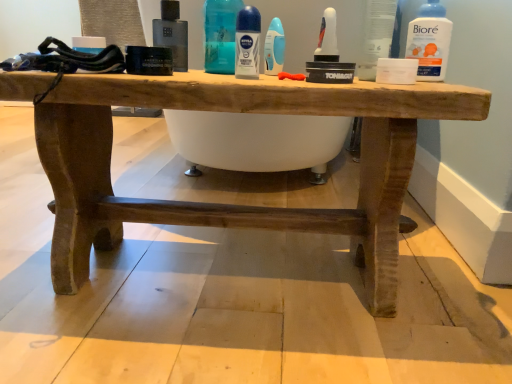
Identify the location of blue glossy deodorant stick at center, which is counted as the second mouthwash, starting from the right. This screenshot has width=512, height=384. (247, 43).

Where is `blue plastic deodorant at center, placed as the 2th cleaning product when sorted from right to left`? blue plastic deodorant at center, placed as the 2th cleaning product when sorted from right to left is located at coordinates (220, 35).

Where is `blue glossy deodorant stick at center, the 2th cleaning product viewed from the left`? The height and width of the screenshot is (384, 512). blue glossy deodorant stick at center, the 2th cleaning product viewed from the left is located at coordinates (274, 48).

Identify the location of white plastic bottle at upper right, which is the 1th mouthwash in right-to-left order. The image size is (512, 384). (429, 41).

The height and width of the screenshot is (384, 512). What do you see at coordinates (376, 36) in the screenshot? I see `transparent plastic container at upper right` at bounding box center [376, 36].

Locate an element on the screen. The image size is (512, 384). blue glossy deodorant stick at center, the second mouthwash when ordered from left to right is located at coordinates (247, 43).

Does point (268, 58) come behind point (245, 42)?

Yes, it is.

Where is `the 3rd mouthwash in front of the blue glossy deodorant stick at center, the 2th cleaning product viewed from the left, starting your count from the anchor`? This screenshot has width=512, height=384. the 3rd mouthwash in front of the blue glossy deodorant stick at center, the 2th cleaning product viewed from the left, starting your count from the anchor is located at coordinates (247, 43).

Consider the image. From a real-world perspective, is blue glossy deodorant stick at center, the 2th cleaning product viewed from the left, located higher than blue glossy deodorant stick at center, which is counted as the second mouthwash, starting from the right?

No, from a real-world perspective, blue glossy deodorant stick at center, the 2th cleaning product viewed from the left, is not above blue glossy deodorant stick at center, which is counted as the second mouthwash, starting from the right.

Which is more to the right, blue glossy deodorant stick at center, the 2th cleaning product viewed from the left, or blue glossy deodorant stick at center, the second mouthwash when ordered from left to right?

From the viewer's perspective, blue glossy deodorant stick at center, the 2th cleaning product viewed from the left, appears more on the right side.

In the scene shown: Is white plastic bottle at upper right, which is the 1th mouthwash in right-to-left order, positioned with its back to matte black bottle at center, placed as the 1th mouthwash when sorted from left to right?

No, matte black bottle at center, placed as the 1th mouthwash when sorted from left to right, is not at the back of white plastic bottle at upper right, which is the 1th mouthwash in right-to-left order.

Identify the location of mouthwash above the white plastic bottle at upper right, which is the 1th mouthwash in right-to-left order (from the image's perspective). (172, 34).

Would you say matte black bottle at center, the 3th mouthwash positioned from the right, is part of white plastic bottle at upper right, the third mouthwash when ordered from left to right,'s contents?

Definitely not — matte black bottle at center, the 3th mouthwash positioned from the right, is not inside white plastic bottle at upper right, the third mouthwash when ordered from left to right.

From a real-world perspective, is blue glossy deodorant stick at center, positioned as the first cleaning product in right-to-left order, beneath transparent plastic container at upper right?

Yes.

Considering the relative sizes of blue glossy deodorant stick at center, positioned as the first cleaning product in right-to-left order, and transparent plastic container at upper right in the image provided, is blue glossy deodorant stick at center, positioned as the first cleaning product in right-to-left order, shorter than transparent plastic container at upper right?

Yes.

Identify the location of the 2nd cleaning product behind when counting from the transparent plastic container at upper right. The image size is (512, 384). (274, 48).

Is blue glossy deodorant stick at center, positioned as the first cleaning product in right-to-left order, beside transparent plastic container at upper right?

blue glossy deodorant stick at center, positioned as the first cleaning product in right-to-left order, and transparent plastic container at upper right are not in contact.

Is point (321, 87) behind point (372, 17)?

No, it is in front of (372, 17).

Which of these two, rustic wood table at center or transparent plastic container at upper right, is bigger?

With larger size is rustic wood table at center.

From a real-world perspective, is rustic wood table at center on transparent plastic container at upper right?

No.

Does white plastic bottle at upper right, which is the 1th mouthwash in right-to-left order, touch rustic wood table at center?

No, white plastic bottle at upper right, which is the 1th mouthwash in right-to-left order, is not beside rustic wood table at center.

Is white plastic bottle at upper right, the third mouthwash when ordered from left to right, shorter than rustic wood table at center?

Yes.

From the image's perspective, is white plastic bottle at upper right, the third mouthwash when ordered from left to right, above or below rustic wood table at center?

white plastic bottle at upper right, the third mouthwash when ordered from left to right, is above rustic wood table at center.

From a real-world perspective, is white plastic bottle at upper right, which is the 1th mouthwash in right-to-left order, physically below rustic wood table at center?

No, from a real-world perspective, white plastic bottle at upper right, which is the 1th mouthwash in right-to-left order, is not under rustic wood table at center.

Is matte black bottle at center, placed as the 1th mouthwash when sorted from left to right, completely or partially outside of rustic wood table at center?

That's correct, matte black bottle at center, placed as the 1th mouthwash when sorted from left to right, is outside of rustic wood table at center.

Consider the image. Measure the distance from matte black bottle at center, placed as the 1th mouthwash when sorted from left to right, to rustic wood table at center.

matte black bottle at center, placed as the 1th mouthwash when sorted from left to right, is 29.18 centimeters from rustic wood table at center.

Consider the image. Is matte black bottle at center, placed as the 1th mouthwash when sorted from left to right, wider or thinner than rustic wood table at center?

In the image, matte black bottle at center, placed as the 1th mouthwash when sorted from left to right, appears to be more narrow than rustic wood table at center.

Is rustic wood table at center at the back of matte black bottle at center, placed as the 1th mouthwash when sorted from left to right?

That's not correct — matte black bottle at center, placed as the 1th mouthwash when sorted from left to right, is not looking away from rustic wood table at center.

Considering the relative positions of rustic wood table at center and blue plastic deodorant at center, placed as the 2th cleaning product when sorted from right to left, in the image provided, is rustic wood table at center in front of blue plastic deodorant at center, placed as the 2th cleaning product when sorted from right to left,?

That is True.

Can you confirm if rustic wood table at center is thinner than blue plastic deodorant at center, the 1th cleaning product positioned from the left?

In fact, rustic wood table at center might be wider than blue plastic deodorant at center, the 1th cleaning product positioned from the left.

Is rustic wood table at center touching blue plastic deodorant at center, the 1th cleaning product positioned from the left?

No, rustic wood table at center is not beside blue plastic deodorant at center, the 1th cleaning product positioned from the left.

From their relative heights in the image, would you say rustic wood table at center is taller or shorter than blue plastic deodorant at center, the 1th cleaning product positioned from the left?

→ Considering their sizes, rustic wood table at center has more height than blue plastic deodorant at center, the 1th cleaning product positioned from the left.

The image size is (512, 384). What are the coordinates of `cleaning product that is the 2nd one when counting backward from the blue glossy deodorant stick at center, the second mouthwash when ordered from left to right` in the screenshot? It's located at (274, 48).

What are the coordinates of `the 1st mouthwash positioned below the matte black bottle at center, the 3th mouthwash positioned from the right (from the image's perspective)` in the screenshot? It's located at (429, 41).

From the image, which object appears to be farther from matte black bottle at center, the 3th mouthwash positioned from the right, blue glossy deodorant stick at center, the second mouthwash when ordered from left to right, or white plastic bottle at upper right, which is the 1th mouthwash in right-to-left order?

white plastic bottle at upper right, which is the 1th mouthwash in right-to-left order, is positioned further to the anchor matte black bottle at center, the 3th mouthwash positioned from the right.

Estimate the real-world distances between objects in this image. Which object is closer to white plastic bottle at upper right, the third mouthwash when ordered from left to right, blue glossy deodorant stick at center, the 2th cleaning product viewed from the left, or blue plastic deodorant at center, the 1th cleaning product positioned from the left?

blue glossy deodorant stick at center, the 2th cleaning product viewed from the left, is closer to white plastic bottle at upper right, the third mouthwash when ordered from left to right.

Estimate the real-world distances between objects in this image. Which object is closer to blue glossy deodorant stick at center, which is counted as the second mouthwash, starting from the right, white plastic bottle at upper right, the third mouthwash when ordered from left to right, or blue plastic deodorant at center, the 1th cleaning product positioned from the left?

blue plastic deodorant at center, the 1th cleaning product positioned from the left, lies closer to blue glossy deodorant stick at center, which is counted as the second mouthwash, starting from the right, than the other object.

Estimate the real-world distances between objects in this image. Which object is closer to transparent plastic container at upper right, blue glossy deodorant stick at center, the second mouthwash when ordered from left to right, or rustic wood table at center?

Among the two, blue glossy deodorant stick at center, the second mouthwash when ordered from left to right, is located nearer to transparent plastic container at upper right.

Which object lies nearer to the anchor point rustic wood table at center, blue glossy deodorant stick at center, which is counted as the second mouthwash, starting from the right, or matte black bottle at center, the 3th mouthwash positioned from the right?

blue glossy deodorant stick at center, which is counted as the second mouthwash, starting from the right.

Considering their positions, is blue glossy deodorant stick at center, the 2th cleaning product viewed from the left, positioned closer to white plastic bottle at upper right, the third mouthwash when ordered from left to right, than matte black bottle at center, placed as the 1th mouthwash when sorted from left to right?

Among the two, blue glossy deodorant stick at center, the 2th cleaning product viewed from the left, is located nearer to white plastic bottle at upper right, the third mouthwash when ordered from left to right.

Estimate the real-world distances between objects in this image. Which object is further from blue glossy deodorant stick at center, positioned as the first cleaning product in right-to-left order, blue glossy deodorant stick at center, the second mouthwash when ordered from left to right, or rustic wood table at center?

rustic wood table at center is further to blue glossy deodorant stick at center, positioned as the first cleaning product in right-to-left order.

When comparing their distances from blue glossy deodorant stick at center, which is counted as the second mouthwash, starting from the right, does blue glossy deodorant stick at center, positioned as the first cleaning product in right-to-left order, or matte black bottle at center, the 3th mouthwash positioned from the right, seem further?

Based on the image, matte black bottle at center, the 3th mouthwash positioned from the right, appears to be further to blue glossy deodorant stick at center, which is counted as the second mouthwash, starting from the right.

Locate an element on the screen. This screenshot has height=384, width=512. toiletry that lies between blue plastic deodorant at center, placed as the 2th cleaning product when sorted from right to left, and rustic wood table at center from top to bottom is located at coordinates (376, 36).

This screenshot has width=512, height=384. Find the location of `cleaning product located between rustic wood table at center and white plastic bottle at upper right, the third mouthwash when ordered from left to right, in the left-right direction`. cleaning product located between rustic wood table at center and white plastic bottle at upper right, the third mouthwash when ordered from left to right, in the left-right direction is located at coordinates tap(274, 48).

Identify the location of toiletry between rustic wood table at center and white plastic bottle at upper right, the third mouthwash when ordered from left to right. This screenshot has height=384, width=512. (376, 36).

Identify the location of mouthwash between blue plastic deodorant at center, the 1th cleaning product positioned from the left, and transparent plastic container at upper right, in the horizontal direction. Image resolution: width=512 pixels, height=384 pixels. (247, 43).